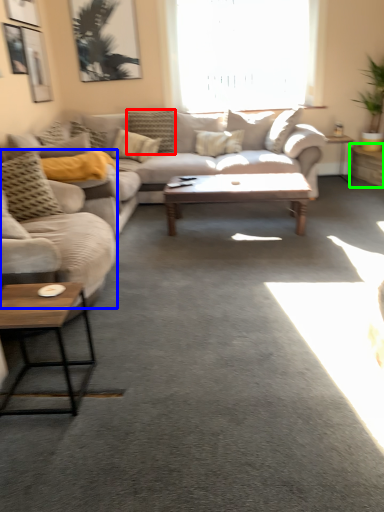
Question: Estimate the real-world distances between objects in this image. Which object is farther from pillow (highlighted by a red box), studio couch (highlighted by a blue box) or table (highlighted by a green box)?

Choices:
 (A) studio couch
 (B) table

Answer: (A)